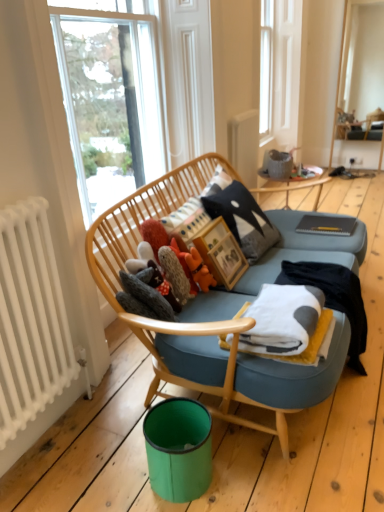
What do you see at coordinates (334, 298) in the screenshot? This screenshot has height=512, width=384. I see `white soft fabric at right` at bounding box center [334, 298].

This screenshot has width=384, height=512. Identify the location of black felt pillow at center. (243, 219).

At what (x,y) coordinates should I click in order to perform the action: click on fuzzy gray stuffed animal at center, the first toy when ordered from left to right. Please return your answer as a coordinate pair (x, y). Looking at the image, I should click on (159, 283).

What is the approximate height of matte gray notebook at center?

matte gray notebook at center is 1.81 inches tall.

Locate an element on the screen. Image resolution: width=384 pixels, height=512 pixels. white soft fabric at right is located at coordinates (334, 298).

Identify the location of teal on the right of fuzzy gray stuffed animal at center, which is counted as the third toy, starting from the right. This screenshot has height=512, width=384. 178,449.

Which is correct: fuzzy gray stuffed animal at center, which is counted as the third toy, starting from the right, is inside teal plastic bin at lower center, or outside of it?

fuzzy gray stuffed animal at center, which is counted as the third toy, starting from the right, is spatially situated outside teal plastic bin at lower center.

Is teal plastic bin at lower center at the back of fuzzy gray stuffed animal at center, which is counted as the third toy, starting from the right?

fuzzy gray stuffed animal at center, which is counted as the third toy, starting from the right, does not have its back to teal plastic bin at lower center.

The image size is (384, 512). I want to click on blanket below the fuzzy gray stuffed animal at center, which is counted as the third toy, starting from the right (from the image's perspective), so click(x=282, y=320).

Between fuzzy gray stuffed animal at center, the first toy when ordered from left to right, and white soft blanket at center, which one has smaller width?

Thinner between the two is fuzzy gray stuffed animal at center, the first toy when ordered from left to right.

From a real-world perspective, is fuzzy gray stuffed animal at center, the first toy when ordered from left to right, beneath white soft blanket at center?

Yes.

Which object is further away from the camera, fuzzy gray stuffed animal at center, which is counted as the third toy, starting from the right, or white soft blanket at center?

fuzzy gray stuffed animal at center, which is counted as the third toy, starting from the right, is further away from the camera.

Are fluffy fabric stuffed animals at center, which is the second toy in left-to-right order, and fuzzy gray stuffed animal at center, the first toy when ordered from left to right, beside each other?

Yes, fluffy fabric stuffed animals at center, which is the second toy in left-to-right order, is in contact with fuzzy gray stuffed animal at center, the first toy when ordered from left to right.

Considering the positions of objects fluffy fabric stuffed animals at center, the 2th toy from the right, and fuzzy gray stuffed animal at center, the first toy when ordered from left to right, in the image provided, who is behind, fluffy fabric stuffed animals at center, the 2th toy from the right, or fuzzy gray stuffed animal at center, the first toy when ordered from left to right,?

Positioned behind is fluffy fabric stuffed animals at center, the 2th toy from the right.

Is fluffy fabric stuffed animals at center, the 2th toy from the right, positioned with its back to fuzzy gray stuffed animal at center, the first toy when ordered from left to right?

No, fluffy fabric stuffed animals at center, the 2th toy from the right, is not facing away from fuzzy gray stuffed animal at center, the first toy when ordered from left to right.

Considering the relative sizes of fluffy fabric stuffed animals at center, which is the second toy in left-to-right order, and fuzzy gray stuffed animal at center, the first toy when ordered from left to right, in the image provided, is fluffy fabric stuffed animals at center, which is the second toy in left-to-right order, thinner than fuzzy gray stuffed animal at center, the first toy when ordered from left to right,?

No.

Is wooden table at center situated inside fluffy orange toy at center, acting as the 3th toy starting from the left, or outside?

wooden table at center is spatially situated outside fluffy orange toy at center, acting as the 3th toy starting from the left.

Based on the photo, what's the angular difference between wooden table at center and fluffy orange toy at center, acting as the 3th toy starting from the left,'s facing directions?

The angle between the facing direction of wooden table at center and the facing direction of fluffy orange toy at center, acting as the 3th toy starting from the left, is 5.24 degrees.

Relative to fluffy orange toy at center, acting as the 3th toy starting from the left, is wooden table at center in front or behind?

Clearly, wooden table at center is behind fluffy orange toy at center, acting as the 3th toy starting from the left.

In the scene shown: Considering the sizes of wooden table at center and fluffy orange toy at center, acting as the 3th toy starting from the left, in the image, is wooden table at center wider or thinner than fluffy orange toy at center, acting as the 3th toy starting from the left,?

In the image, wooden table at center appears to be wider than fluffy orange toy at center, acting as the 3th toy starting from the left.

Considering the positions of objects matte gray vase at upper center and fluffy orange toy at center, marked as the first toy in a right-to-left arrangement, in the image provided, who is more to the right, matte gray vase at upper center or fluffy orange toy at center, marked as the first toy in a right-to-left arrangement,?

From the viewer's perspective, matte gray vase at upper center appears more on the right side.

How many degrees apart are the facing directions of matte gray vase at upper center and fluffy orange toy at center, acting as the 3th toy starting from the left?

3.54 degrees.

From a real-world perspective, between matte gray vase at upper center and fluffy orange toy at center, acting as the 3th toy starting from the left, who is vertically higher?

From a 3D spatial view, matte gray vase at upper center is above.

Which of these two, matte gray vase at upper center or fluffy orange toy at center, marked as the first toy in a right-to-left arrangement, is wider?

Wider between the two is fluffy orange toy at center, marked as the first toy in a right-to-left arrangement.

How many degrees apart are the facing directions of fuzzy gray stuffed animal at center, which is counted as the third toy, starting from the right, and fluffy fabric stuffed animals at center, which is the second toy in left-to-right order?

There is a 1.26-degree angle between the facing directions of fuzzy gray stuffed animal at center, which is counted as the third toy, starting from the right, and fluffy fabric stuffed animals at center, which is the second toy in left-to-right order.

Looking at the image, does fuzzy gray stuffed animal at center, the first toy when ordered from left to right, seem bigger or smaller compared to fluffy fabric stuffed animals at center, which is the second toy in left-to-right order?

In the image, fuzzy gray stuffed animal at center, the first toy when ordered from left to right, appears to be smaller than fluffy fabric stuffed animals at center, which is the second toy in left-to-right order.

From a real-world perspective, which is physically above, fuzzy gray stuffed animal at center, which is counted as the third toy, starting from the right, or fluffy fabric stuffed animals at center, which is the second toy in left-to-right order?

fluffy fabric stuffed animals at center, which is the second toy in left-to-right order.

Is fuzzy gray stuffed animal at center, which is counted as the third toy, starting from the right, to the right of fluffy fabric stuffed animals at center, the 2th toy from the right, from the viewer's perspective?

In fact, fuzzy gray stuffed animal at center, which is counted as the third toy, starting from the right, is to the left of fluffy fabric stuffed animals at center, the 2th toy from the right.

Considering the positions of objects white soft fabric at right and wooden table at center in the image provided, who is more to the left, white soft fabric at right or wooden table at center?

white soft fabric at right is more to the left.

Is wooden table at center completely or partially inside white soft fabric at right?

No, wooden table at center is not inside white soft fabric at right.

Is white soft fabric at right wider than wooden table at center?

Incorrect, the width of white soft fabric at right does not surpass that of wooden table at center.

From a real-world perspective, is white soft fabric at right positioned under wooden table at center based on gravity?

Correct, in the physical world, white soft fabric at right is lower than wooden table at center.

There is a teal plastic bin at lower center. Where is `the 2nd toy above it (from a real-world perspective)`? This screenshot has width=384, height=512. the 2nd toy above it (from a real-world perspective) is located at coordinates (159, 283).

What are the coordinates of `the 1st toy positioned below the white soft blanket at center (from a real-world perspective)` in the screenshot? It's located at (159, 283).

From the image, which object appears to be farther from wooden picture frame at center, matte gray vase at upper center or white soft blanket at center?

matte gray vase at upper center.

Considering their positions, is white soft fabric at right positioned closer to fluffy fabric stuffed animals at center, the 2th toy from the right, than matte gray notebook at center?

Based on the image, white soft fabric at right appears to be nearer to fluffy fabric stuffed animals at center, the 2th toy from the right.

Estimate the real-world distances between objects in this image. Which object is further from matte gray vase at upper center, black felt pillow at center or matte gray notebook at center?

black felt pillow at center is further to matte gray vase at upper center.

Estimate the real-world distances between objects in this image. Which object is closer to white soft fabric at right, white radiator at left or matte gray notebook at center?

matte gray notebook at center.

Which object lies further to the anchor point wooden picture frame at center, wooden table at center or fuzzy gray stuffed animal at center, the first toy when ordered from left to right?

wooden table at center lies further to wooden picture frame at center than the other object.

Considering their positions, is matte gray notebook at center positioned closer to teal plastic bin at lower center than wooden table at center?

matte gray notebook at center is positioned closer to the anchor teal plastic bin at lower center.

Which object lies further to the anchor point black felt pillow at center, fluffy fabric stuffed animals at center, the 2th toy from the right, or fuzzy gray stuffed animal at center, the first toy when ordered from left to right?

fuzzy gray stuffed animal at center, the first toy when ordered from left to right.

Estimate the real-world distances between objects in this image. Which object is closer to matte gray notebook at center, wooden table at center or fluffy orange toy at center, marked as the first toy in a right-to-left arrangement?

Among the two, wooden table at center is located nearer to matte gray notebook at center.

Locate an element on the screen. This screenshot has width=384, height=512. pillow between matte gray vase at upper center and white soft blanket at center in the vertical direction is located at coordinates (243, 219).

Where is `blanket located between teal plastic bin at lower center and wooden table at center in the depth direction`? blanket located between teal plastic bin at lower center and wooden table at center in the depth direction is located at coordinates (282, 320).

Where is `magazine between matte gray vase at upper center and white soft fabric at right in the up-down direction`? The image size is (384, 512). magazine between matte gray vase at upper center and white soft fabric at right in the up-down direction is located at coordinates (326, 224).

Where is `magazine located between wooden picture frame at center and wooden table at center in the depth direction`? magazine located between wooden picture frame at center and wooden table at center in the depth direction is located at coordinates (326, 224).